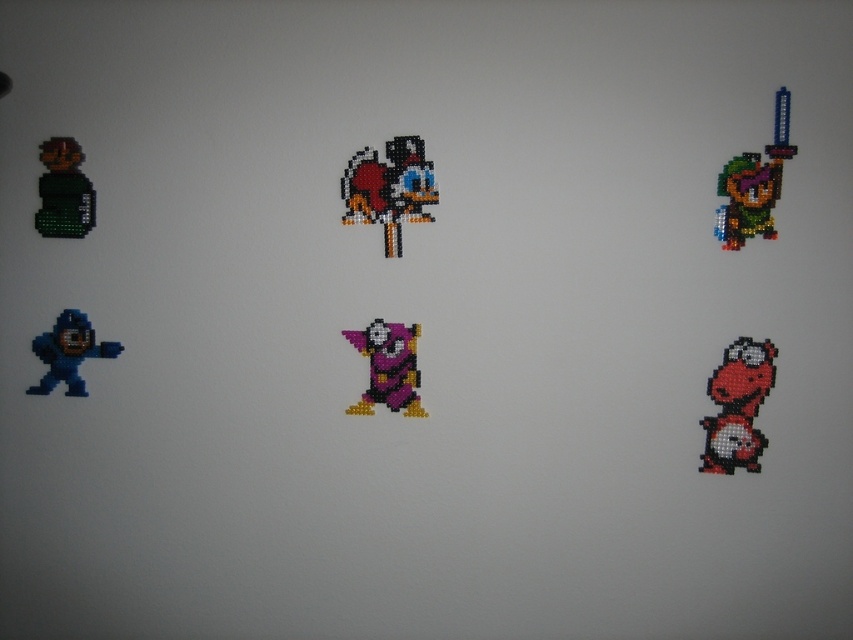
Does point (415, 362) come closer to viewer compared to point (42, 385)?

Yes, it is.

Describe the element at coordinates (387, 368) in the screenshot. The image size is (853, 640). I see `purple matte jester at center` at that location.

I want to click on purple matte jester at center, so click(x=387, y=368).

Can you confirm if matte red dog at lower right is wider than purple matte jester at center?

No.

Is point (740, 412) less distant than point (416, 369)?

Yes, it is in front of point (416, 369).

Is point (759, 356) in front of point (344, 330)?

That is True.

Locate an element on the screen. The image size is (853, 640). matte red dog at lower right is located at coordinates (737, 406).

Who is shorter, purple matte jester at center or matte green figure at upper left?

purple matte jester at center is shorter.

Does point (407, 404) lie behind point (61, 152)?

Yes, point (407, 404) is farther from viewer.

Who is more forward, (399,397) or (44,232)?

Point (399,397) is more forward.

The height and width of the screenshot is (640, 853). In order to click on purple matte jester at center in this screenshot , I will do `click(387, 368)`.